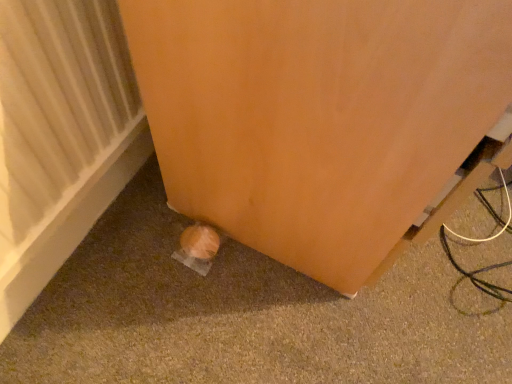
Question: Should I look upward or downward to see matte orange door at lower left?

Choices:
 (A) up
 (B) down

Answer: (A)

Question: From the image's perspective, does matte orange door at lower left appear lower than white textured radiator at lower left?

Choices:
 (A) yes
 (B) no

Answer: (B)

Question: Can you confirm if matte orange door at lower left is smaller than white textured radiator at lower left?

Choices:
 (A) yes
 (B) no

Answer: (B)

Question: Is matte orange door at lower left oriented away from white textured radiator at lower left?

Choices:
 (A) no
 (B) yes

Answer: (A)

Question: Is matte orange door at lower left further to the viewer compared to white textured radiator at lower left?

Choices:
 (A) yes
 (B) no

Answer: (B)

Question: Considering the relative sizes of matte orange door at lower left and white textured radiator at lower left in the image provided, is matte orange door at lower left shorter than white textured radiator at lower left?

Choices:
 (A) no
 (B) yes

Answer: (A)

Question: Can you confirm if matte orange door at lower left is bigger than white textured radiator at lower left?

Choices:
 (A) yes
 (B) no

Answer: (A)

Question: From the image's perspective, does white textured radiator at lower left appear higher than matte orange door at lower left?

Choices:
 (A) no
 (B) yes

Answer: (A)

Question: Considering the relative sizes of white textured radiator at lower left and matte orange door at lower left in the image provided, is white textured radiator at lower left bigger than matte orange door at lower left?

Choices:
 (A) yes
 (B) no

Answer: (B)

Question: From a real-world perspective, is white textured radiator at lower left physically above matte orange door at lower left?

Choices:
 (A) no
 (B) yes

Answer: (A)

Question: Considering the relative sizes of white textured radiator at lower left and matte orange door at lower left in the image provided, is white textured radiator at lower left shorter than matte orange door at lower left?

Choices:
 (A) no
 (B) yes

Answer: (B)

Question: Can you confirm if white textured radiator at lower left is smaller than matte orange door at lower left?

Choices:
 (A) yes
 (B) no

Answer: (A)

Question: Is white textured radiator at lower left surrounding matte orange door at lower left?

Choices:
 (A) yes
 (B) no

Answer: (B)

Question: Is white textured radiator at lower left inside or outside of matte orange door at lower left?

Choices:
 (A) outside
 (B) inside

Answer: (A)